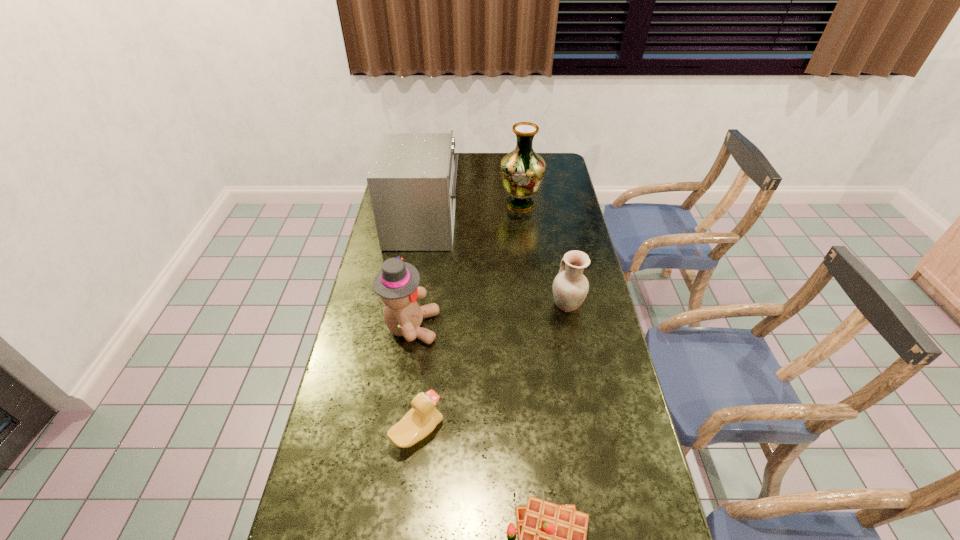
Where is `vacant position located at the beak of the fifth farthest object`? The image size is (960, 540). vacant position located at the beak of the fifth farthest object is located at coordinates (555, 431).

Identify the location of toaster oven positioned at the left edge. This screenshot has height=540, width=960. (412, 180).

Locate an element on the screen. rag_doll present at the left edge is located at coordinates (397, 282).

The image size is (960, 540). Identify the location of vase at the right edge. (522, 171).

At what (x,y) coordinates should I click in order to perform the action: click on pottery located in the right edge section of the desktop. Please return your answer as a coordinate pair (x, y). Looking at the image, I should click on (570, 287).

This screenshot has height=540, width=960. What are the coordinates of `vacant space at the far edge of the desktop` in the screenshot? It's located at (488, 158).

Locate an element on the screen. This screenshot has height=540, width=960. free space at the left edge is located at coordinates (377, 237).

You are a GUI agent. You are given a task and a screenshot of the screen. Output one action in this format:
    pyautogui.click(x=<x>, y=<y>)
    Task: Click on the vacant space at the right edge of the desktop
    Image resolution: width=960 pixels, height=540 pixels.
    Given the screenshot: What is the action you would take?
    pyautogui.click(x=550, y=182)

In order to click on blank area at the far right corner in this screenshot , I will do `click(550, 156)`.

Find the location of `vacant region between the vase and the rag_doll`. vacant region between the vase and the rag_doll is located at coordinates (466, 265).